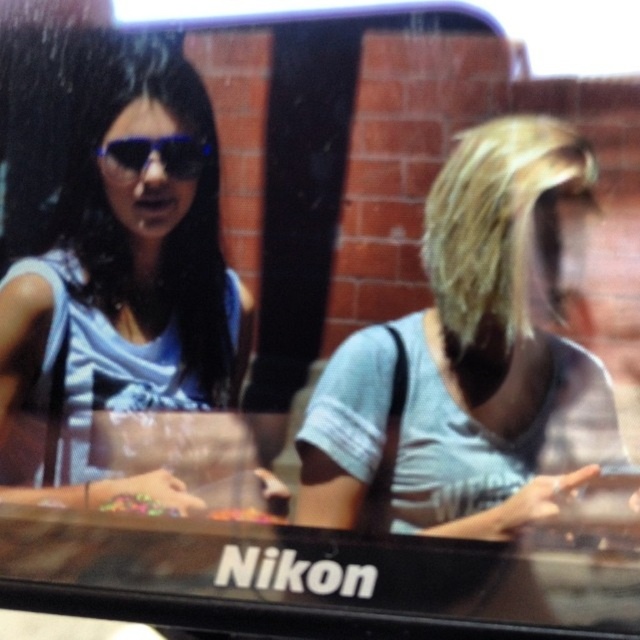
Question: Which object is the closest to the matte blue sunglasses at upper left?

Choices:
 (A) translucent plastic candy at center
 (B) multicolored candy at center
 (C) matte blue dress at upper left

Answer: (C)

Question: Observing the image, what is the correct spatial positioning of gray cotton shirt at right in reference to matte blue dress at upper left?

Choices:
 (A) right
 (B) left

Answer: (A)

Question: Which of these objects is positioned farthest from the matte blue dress at upper left?

Choices:
 (A) translucent plastic candy at center
 (B) matte blue sunglasses at upper left
 (C) gray cotton shirt at right

Answer: (A)

Question: Which point is farther to the camera?

Choices:
 (A) (157, 513)
 (B) (518, 524)
 (C) (74, 147)
 (D) (116, 172)

Answer: (A)

Question: Is multicolored candy at center closer to the viewer compared to translucent plastic candy at center?

Choices:
 (A) no
 (B) yes

Answer: (A)

Question: Can you confirm if matte blue sunglasses at upper left is positioned below multicolored candy at center?

Choices:
 (A) no
 (B) yes

Answer: (A)